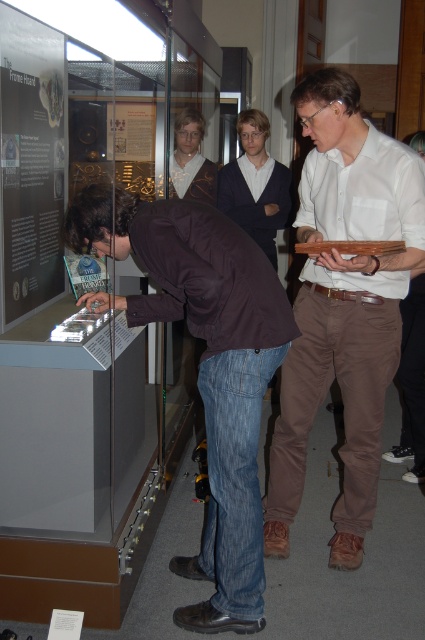
Question: Can you confirm if brown leather jacket at lower left is positioned below matte brown vest at center?

Choices:
 (A) no
 (B) yes

Answer: (B)

Question: Does matte white shirt at center have a larger size compared to matte brown vest at center?

Choices:
 (A) yes
 (B) no

Answer: (A)

Question: Can you confirm if matte white shirt at center is positioned to the right of matte brown vest at center?

Choices:
 (A) yes
 (B) no

Answer: (A)

Question: Which of the following is the farthest from the observer?

Choices:
 (A) (342, 268)
 (B) (209, 179)
 (C) (274, 227)
 (D) (263, 387)

Answer: (C)

Question: Which object is positioned farthest from the matte white shirt at center?

Choices:
 (A) matte brown vest at center
 (B) dark blue sweater at center

Answer: (B)

Question: Among these objects, which one is nearest to the camera?

Choices:
 (A) matte white shirt at center
 (B) dark blue sweater at center
 (C) matte brown vest at center

Answer: (A)